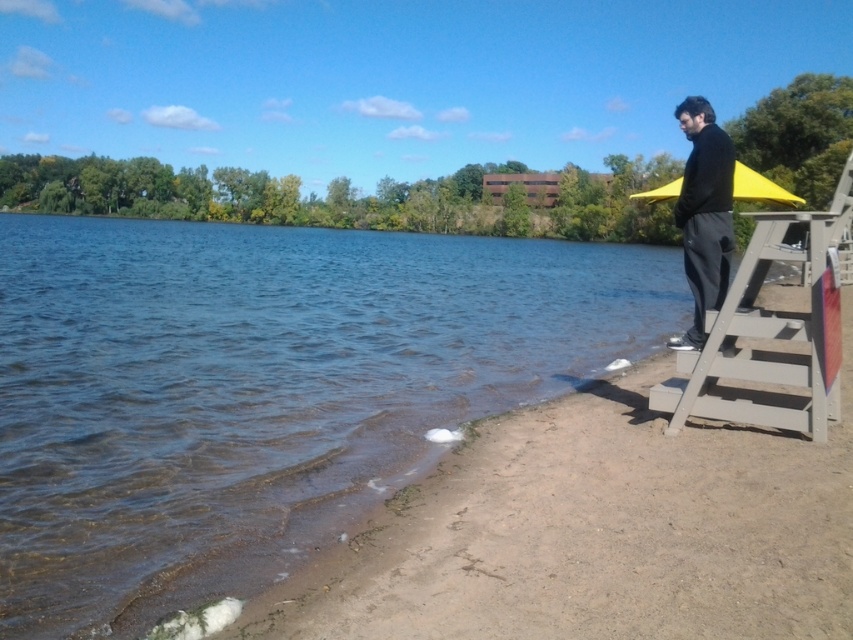
Between point (140, 428) and point (676, 346), which one is positioned behind?

The point (140, 428) is behind.

The image size is (853, 640). What do you see at coordinates (260, 388) in the screenshot? I see `clear blue water at lower left` at bounding box center [260, 388].

This screenshot has width=853, height=640. I want to click on clear blue water at lower left, so click(260, 388).

Does black matte jacket at upper right appear on the left side of yellow matte umbrella at upper right?

In fact, black matte jacket at upper right is to the right of yellow matte umbrella at upper right.

Which is more to the right, black matte jacket at upper right or yellow matte umbrella at upper right?

black matte jacket at upper right is more to the right.

This screenshot has height=640, width=853. What are the coordinates of `black matte jacket at upper right` in the screenshot? It's located at (704, 214).

Who is shorter, light gray wooden ladder at right or yellow matte umbrella at upper right?

light gray wooden ladder at right

Looking at this image, can you confirm if light gray wooden ladder at right is shorter than yellow matte umbrella at upper right?

Yes, light gray wooden ladder at right is shorter than yellow matte umbrella at upper right.

Is point (764, 353) in front of point (756, 177)?

Yes, point (764, 353) is closer to viewer.

The image size is (853, 640). In order to click on light gray wooden ladder at right in this screenshot , I will do `click(773, 330)`.